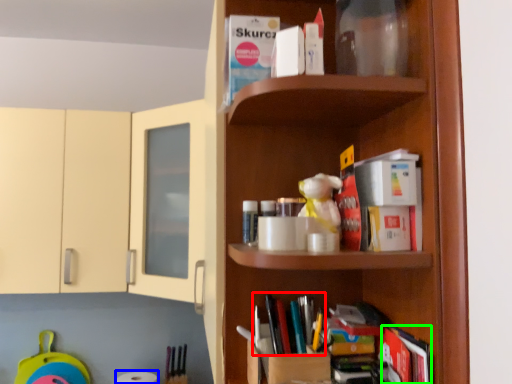
Question: Based on their relative distances, which object is nearer to book (highlighted by a red box)? Choose from toilet paper (highlighted by a blue box) and book (highlighted by a green box).

Choices:
 (A) toilet paper
 (B) book

Answer: (B)